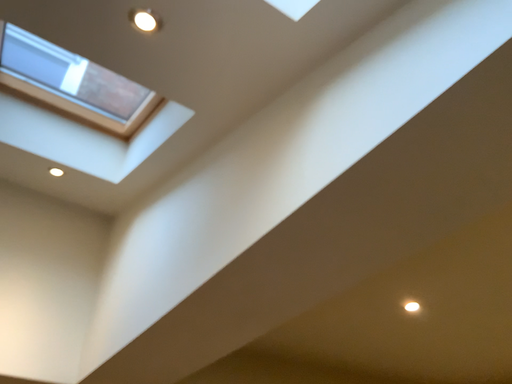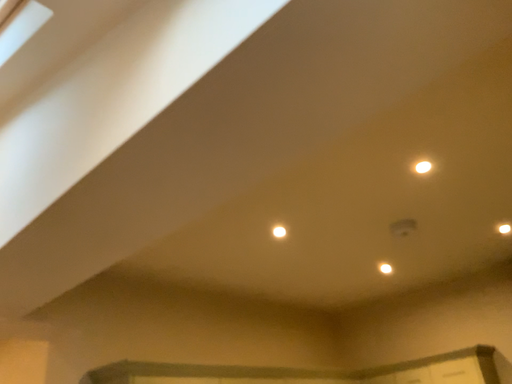
Question: Which way did the camera rotate in the video?

Choices:
 (A) rotated upward
 (B) rotated downward

Answer: (B)